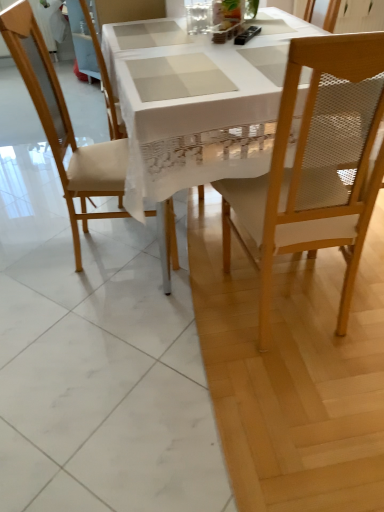
Question: Considering the relative sizes of black plastic remote control at upper center and beige fabric chair at center, which is the second chair from left to right, in the image provided, is black plastic remote control at upper center thinner than beige fabric chair at center, which is the second chair from left to right,?

Choices:
 (A) yes
 (B) no

Answer: (A)

Question: From a real-world perspective, is black plastic remote control at upper center located beneath beige fabric chair at center, which is the 2th chair in right-to-left order?

Choices:
 (A) yes
 (B) no

Answer: (B)

Question: Can you confirm if black plastic remote control at upper center is taller than beige fabric chair at center, which is the second chair from left to right?

Choices:
 (A) yes
 (B) no

Answer: (B)

Question: Is black plastic remote control at upper center positioned with its back to beige fabric chair at center, which is the 2th chair in right-to-left order?

Choices:
 (A) no
 (B) yes

Answer: (A)

Question: Considering the relative positions of black plastic remote control at upper center and beige fabric chair at center, which is the 2th chair in right-to-left order, in the image provided, is black plastic remote control at upper center to the left of beige fabric chair at center, which is the 2th chair in right-to-left order, from the viewer's perspective?

Choices:
 (A) no
 (B) yes

Answer: (A)

Question: Is white lace tablecloth at center in front of or behind light wood mesh chair at right, placed as the 3th chair when sorted from left to right, in the image?

Choices:
 (A) front
 (B) behind

Answer: (B)

Question: Choose the correct answer: Is white lace tablecloth at center inside light wood mesh chair at right, placed as the 3th chair when sorted from left to right, or outside it?

Choices:
 (A) inside
 (B) outside

Answer: (B)

Question: Does point (150, 181) appear closer or farther from the camera than point (370, 35)?

Choices:
 (A) farther
 (B) closer

Answer: (A)

Question: From the image's perspective, relative to light wood mesh chair at right, placed as the 3th chair when sorted from left to right, is white lace tablecloth at center above or below?

Choices:
 (A) below
 (B) above

Answer: (B)

Question: Would you say matte wood chair at left, which is the first chair from left to right, is inside or outside light wood mesh chair at right, placed as the 3th chair when sorted from left to right?

Choices:
 (A) inside
 (B) outside

Answer: (B)

Question: Considering the positions of matte wood chair at left, placed as the 3th chair when sorted from right to left, and light wood mesh chair at right, placed as the 3th chair when sorted from left to right, in the image, is matte wood chair at left, placed as the 3th chair when sorted from right to left, bigger or smaller than light wood mesh chair at right, placed as the 3th chair when sorted from left to right,?

Choices:
 (A) small
 (B) big

Answer: (B)

Question: From a real-world perspective, relative to light wood mesh chair at right, placed as the 3th chair when sorted from left to right, is matte wood chair at left, placed as the 3th chair when sorted from right to left, vertically above or below?

Choices:
 (A) below
 (B) above

Answer: (A)

Question: Considering the relative positions of matte wood chair at left, which is the first chair from left to right, and light wood mesh chair at right, which is the first chair in right-to-left order, in the image provided, is matte wood chair at left, which is the first chair from left to right, to the left or to the right of light wood mesh chair at right, which is the first chair in right-to-left order,?

Choices:
 (A) left
 (B) right

Answer: (A)

Question: Is black plastic remote control at upper center in front of or behind matte wood chair at left, placed as the 3th chair when sorted from right to left, in the image?

Choices:
 (A) behind
 (B) front

Answer: (A)

Question: From their relative heights in the image, would you say black plastic remote control at upper center is taller or shorter than matte wood chair at left, placed as the 3th chair when sorted from right to left?

Choices:
 (A) tall
 (B) short

Answer: (B)